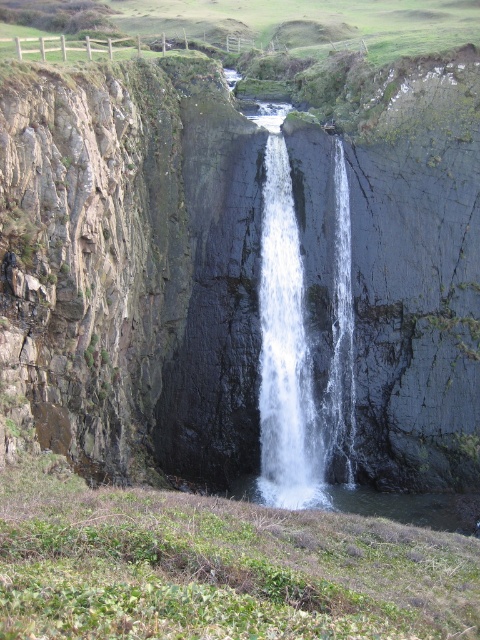
You are standing at the base of the waterfall and want to reach the top of the cliff. There are two points marked on the cliff face that you could use as handholds. One is at point (x=139, y=394) and the other at point (x=290, y=353). Which point should you choose to reach the top more easily?

Point (x=139, y=394) is closer to the viewer than point (x=290, y=353). Therefore, you should choose point (x=139, y=394) as it is closer and would be easier to reach while climbing the cliff face.